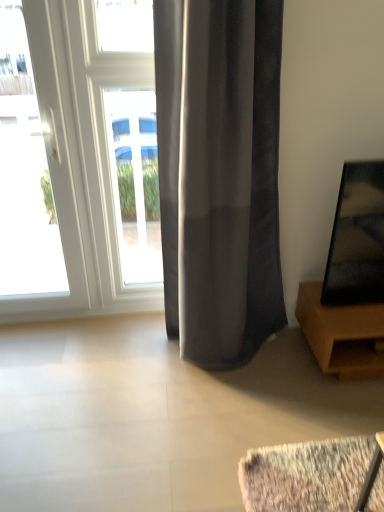
Question: Considering the relative positions of satin gray curtain at center and brown wooden tv stand at right in the image provided, is satin gray curtain at center to the left of brown wooden tv stand at right from the viewer's perspective?

Choices:
 (A) no
 (B) yes

Answer: (B)

Question: Does satin gray curtain at center have a greater width compared to brown wooden tv stand at right?

Choices:
 (A) yes
 (B) no

Answer: (B)

Question: Is satin gray curtain at center turned away from brown wooden tv stand at right?

Choices:
 (A) yes
 (B) no

Answer: (B)

Question: Is satin gray curtain at center at the right side of brown wooden tv stand at right?

Choices:
 (A) no
 (B) yes

Answer: (A)

Question: Is satin gray curtain at center thinner than brown wooden tv stand at right?

Choices:
 (A) no
 (B) yes

Answer: (B)

Question: Is satin gray curtain at center inside or outside of white glossy door at left?

Choices:
 (A) outside
 (B) inside

Answer: (A)

Question: Based on their sizes in the image, would you say satin gray curtain at center is bigger or smaller than white glossy door at left?

Choices:
 (A) big
 (B) small

Answer: (A)

Question: From a real-world perspective, is satin gray curtain at center physically located above or below white glossy door at left?

Choices:
 (A) below
 (B) above

Answer: (B)

Question: Considering the positions of point (228, 237) and point (41, 19), is point (228, 237) closer or farther from the camera than point (41, 19)?

Choices:
 (A) closer
 (B) farther

Answer: (B)

Question: Is satin gray curtain at center taller or shorter than brown wooden tv stand at right?

Choices:
 (A) tall
 (B) short

Answer: (A)

Question: Is satin gray curtain at center to the left or to the right of brown wooden tv stand at right in the image?

Choices:
 (A) left
 (B) right

Answer: (A)

Question: Considering the positions of satin gray curtain at center and brown wooden tv stand at right in the image, is satin gray curtain at center wider or thinner than brown wooden tv stand at right?

Choices:
 (A) wide
 (B) thin

Answer: (B)

Question: Is point (200, 336) positioned closer to the camera than point (362, 347)?

Choices:
 (A) closer
 (B) farther

Answer: (A)

Question: Would you say white glossy window at center is to the left or to the right of satin gray curtain at center in the picture?

Choices:
 (A) right
 (B) left

Answer: (B)

Question: From the image's perspective, is white glossy window at center positioned above or below satin gray curtain at center?

Choices:
 (A) below
 (B) above

Answer: (B)